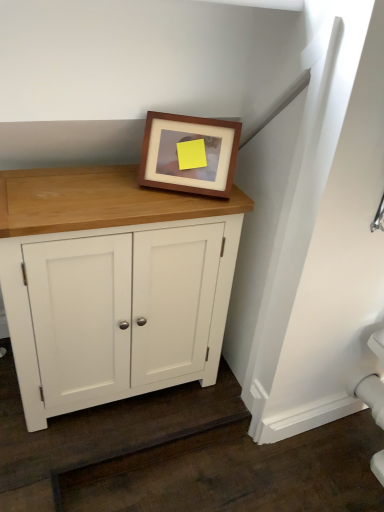
This screenshot has width=384, height=512. What do you see at coordinates (112, 285) in the screenshot? I see `white wood cupboard at center` at bounding box center [112, 285].

In order to click on white wood cupboard at center in this screenshot , I will do `click(112, 285)`.

In order to face white wood cupboard at center, should I rotate leftwards or rightwards?

Turn left approximately 9.980 degrees to face it.

Find the location of a particular element. The height and width of the screenshot is (512, 384). brown wooden picture frame at upper center is located at coordinates (189, 154).

Measure the distance between point (229, 161) and camera.

The distance of point (229, 161) from camera is 1.15 meters.

What is the approximate width of brown wooden picture frame at upper center?

brown wooden picture frame at upper center is 5.16 inches wide.

What do you see at coordinates (189, 154) in the screenshot?
I see `brown wooden picture frame at upper center` at bounding box center [189, 154].

Find the location of a particular element. The image size is (384, 512). white wood cupboard at center is located at coordinates (112, 285).

Is white wood cupboard at center at the right side of brown wooden picture frame at upper center?

No, white wood cupboard at center is not to the right of brown wooden picture frame at upper center.

Is white wood cupboard at center closer to camera compared to brown wooden picture frame at upper center?

Yes, white wood cupboard at center is closer to the viewer.

Does point (28, 227) come closer to viewer compared to point (149, 170)?

Yes, point (28, 227) is closer to viewer.

In the scene shown: From the image's perspective, is white wood cupboard at center on brown wooden picture frame at upper center?

No, from the image's perspective, white wood cupboard at center is not on top of brown wooden picture frame at upper center.

From a real-world perspective, is white wood cupboard at center below brown wooden picture frame at upper center?

Yes, from a real-world perspective, white wood cupboard at center is under brown wooden picture frame at upper center.

Which of these two, white wood cupboard at center or brown wooden picture frame at upper center, is thinner?

brown wooden picture frame at upper center.

From their relative heights in the image, would you say white wood cupboard at center is taller or shorter than brown wooden picture frame at upper center?

Considering their sizes, white wood cupboard at center has more height than brown wooden picture frame at upper center.

Which of these two, white wood cupboard at center or brown wooden picture frame at upper center, is bigger?

white wood cupboard at center is bigger.

Choose the correct answer: Is white wood cupboard at center inside brown wooden picture frame at upper center or outside it?

white wood cupboard at center cannot be found inside brown wooden picture frame at upper center.

From the picture: Is white wood cupboard at center far away from brown wooden picture frame at upper center?

They are positioned close to each other.

Could you tell me if white wood cupboard at center is turned towards brown wooden picture frame at upper center?

No, white wood cupboard at center is not turned towards brown wooden picture frame at upper center.

The height and width of the screenshot is (512, 384). Find the location of `picture frame on the right of white wood cupboard at center`. picture frame on the right of white wood cupboard at center is located at coordinates (189, 154).

Is brown wooden picture frame at upper center at the right side of white wood cupboard at center?

Yes.

In the image, is brown wooden picture frame at upper center positioned in front of or behind white wood cupboard at center?

brown wooden picture frame at upper center is behind white wood cupboard at center.

Between point (212, 154) and point (100, 249), which one is positioned behind?

Point (212, 154)

From the image's perspective, is brown wooden picture frame at upper center above white wood cupboard at center?

A: Yes, from the image's perspective, brown wooden picture frame at upper center is over white wood cupboard at center.

From a real-world perspective, which is physically below, brown wooden picture frame at upper center or white wood cupboard at center?

white wood cupboard at center, from a real-world perspective.

Considering the sizes of objects brown wooden picture frame at upper center and white wood cupboard at center in the image provided, who is thinner, brown wooden picture frame at upper center or white wood cupboard at center?

brown wooden picture frame at upper center.

Who is shorter, brown wooden picture frame at upper center or white wood cupboard at center?

brown wooden picture frame at upper center.

Can you confirm if brown wooden picture frame at upper center is bigger than white wood cupboard at center?

No.

Would you say brown wooden picture frame at upper center is outside white wood cupboard at center?

Yes, brown wooden picture frame at upper center is outside of white wood cupboard at center.

Is brown wooden picture frame at upper center positioned far away from white wood cupboard at center?

They are positioned close to each other.

Is brown wooden picture frame at upper center facing away from white wood cupboard at center?

That's not correct — brown wooden picture frame at upper center is not looking away from white wood cupboard at center.

How many degrees apart are the facing directions of brown wooden picture frame at upper center and white wood cupboard at center?

They differ by 31.2 degrees in their facing directions.

Find the location of `cupboard lying on the left of brown wooden picture frame at upper center`. cupboard lying on the left of brown wooden picture frame at upper center is located at coordinates (112, 285).

The image size is (384, 512). What are the coordinates of `cupboard that is under the brown wooden picture frame at upper center (from a real-world perspective)` in the screenshot? It's located at [112, 285].

Locate an element on the screen. This screenshot has width=384, height=512. cupboard in front of the brown wooden picture frame at upper center is located at coordinates (112, 285).